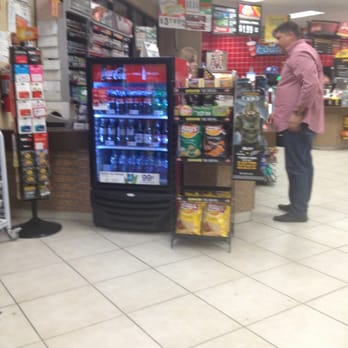
This screenshot has width=348, height=348. I want to click on beverage cooler, so click(132, 76), click(129, 110), click(129, 151), click(129, 194).